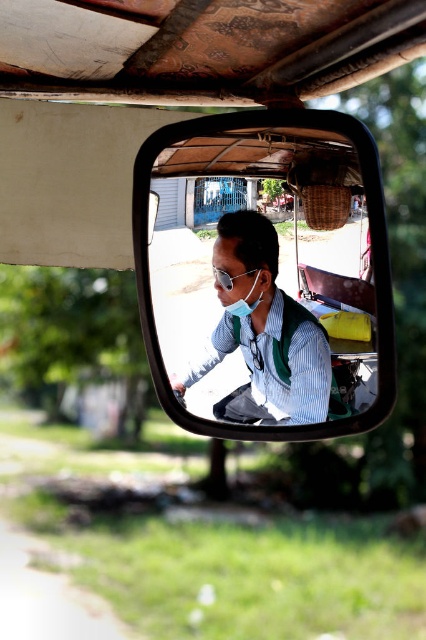
You are a passenger in the rickshaw and looking at the side mirror. There is a point at coordinates (232, 288) in the mirror. What object is located at that point?

The green fabric mask at center is located at point (232, 288).